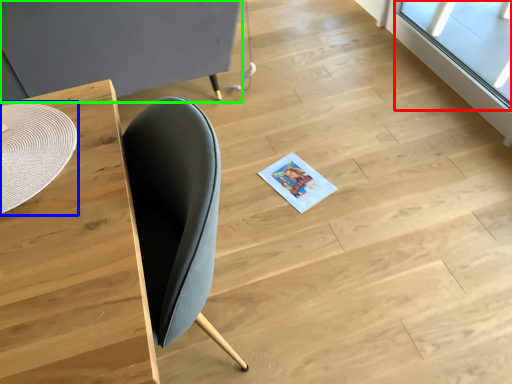
Question: Considering the real-world distances, which object is farthest from window (highlighted by a red box)? round table (highlighted by a blue box) or round table (highlighted by a green box)?

Choices:
 (A) round table
 (B) round table

Answer: (A)